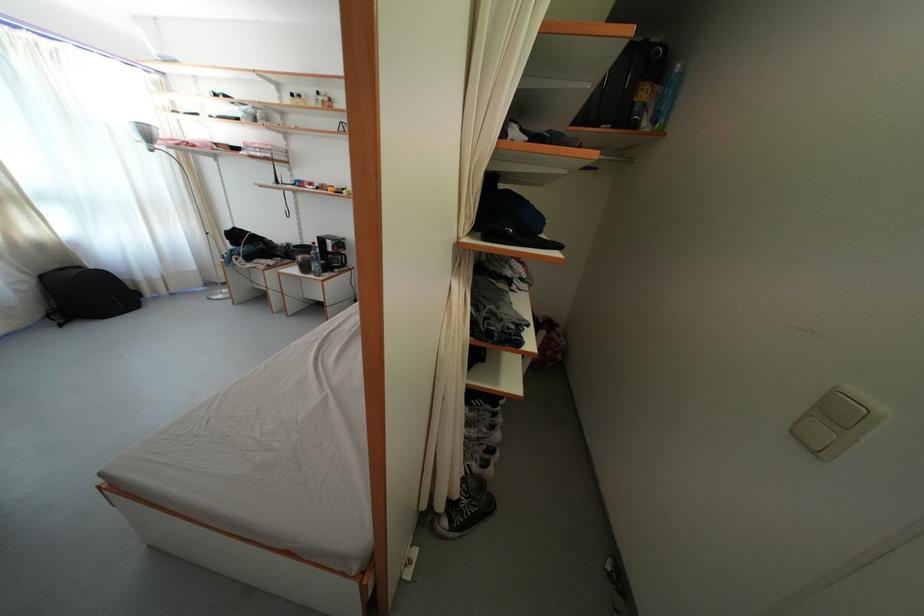
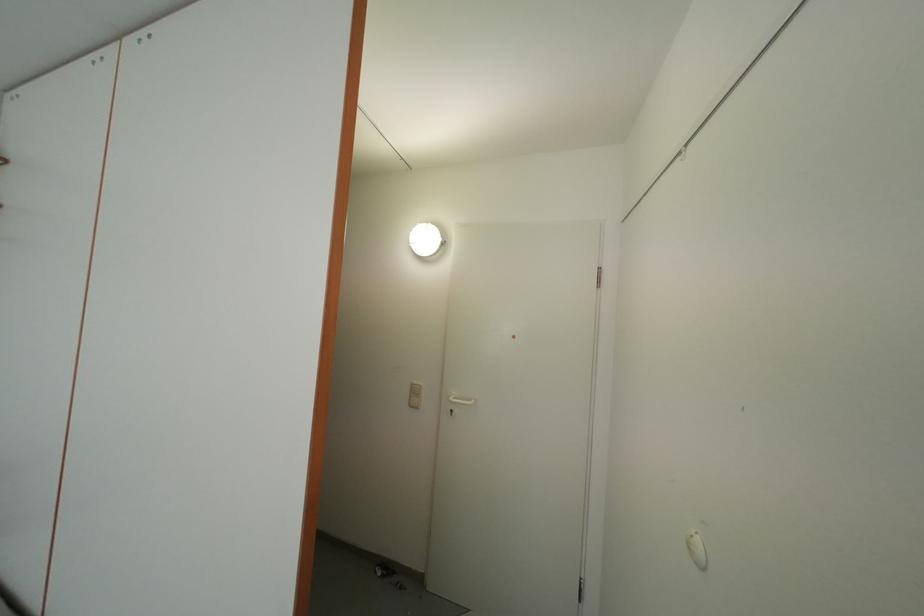
Question: The camera is either moving clockwise (left) or counter-clockwise (right) around the object. The first image is from the beginning of the video and the second image is from the end. Is the camera moving left or right when shooting the video?

Choices:
 (A) Left
 (B) Right

Answer: (A)